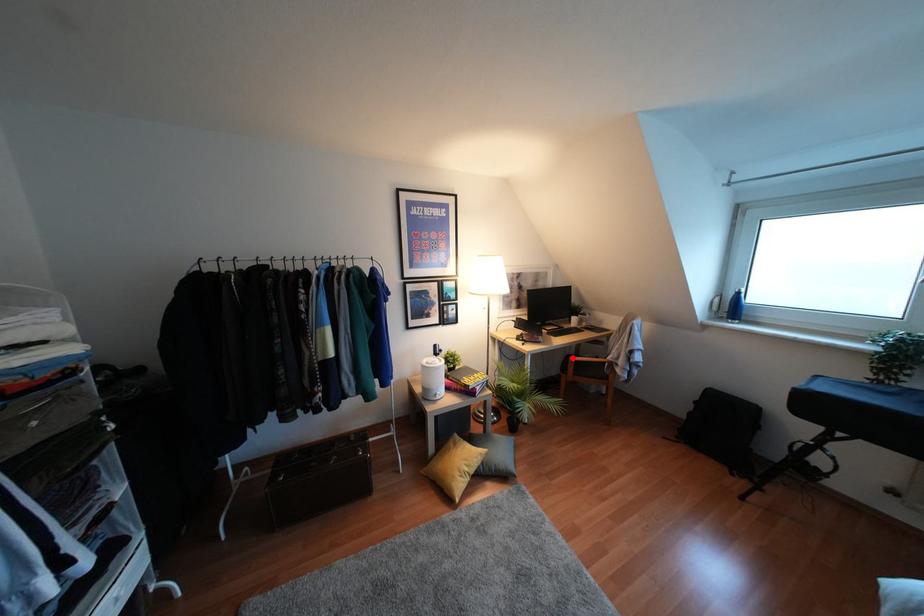
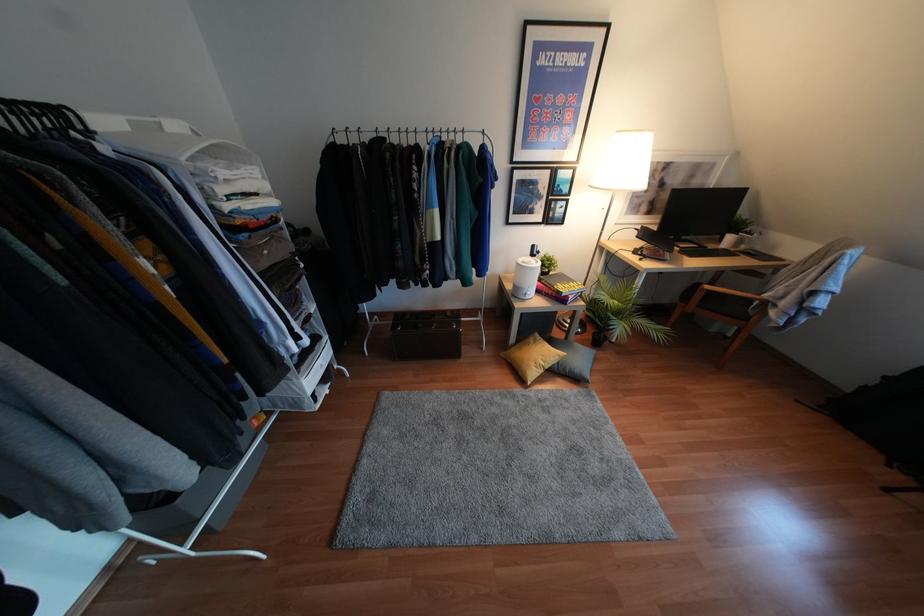
Locate, in the second image, the point that corresponds to the highlighted location in the first image.

(707, 286)